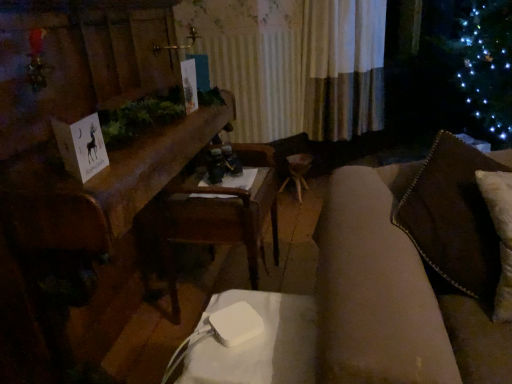
Question: Is white plastic table at lower center completely or partially inside wooden table at center?

Choices:
 (A) no
 (B) yes

Answer: (A)

Question: Can you confirm if wooden table at center is thinner than white plastic table at lower center?

Choices:
 (A) no
 (B) yes

Answer: (A)

Question: Is wooden table at center taller than white plastic table at lower center?

Choices:
 (A) no
 (B) yes

Answer: (B)

Question: Can you confirm if wooden table at center is bigger than white plastic table at lower center?

Choices:
 (A) no
 (B) yes

Answer: (B)

Question: Is wooden table at center positioned with its back to white plastic table at lower center?

Choices:
 (A) no
 (B) yes

Answer: (A)

Question: From the image's perspective, relative to white plastic table at lower center, is wooden armchair at center above or below?

Choices:
 (A) below
 (B) above

Answer: (B)

Question: Is wooden armchair at center taller or shorter than white plastic table at lower center?

Choices:
 (A) short
 (B) tall

Answer: (B)

Question: Based on their positions, is wooden armchair at center located to the left or right of white plastic table at lower center?

Choices:
 (A) left
 (B) right

Answer: (A)

Question: Does point (144, 251) appear closer or farther from the camera than point (248, 362)?

Choices:
 (A) closer
 (B) farther

Answer: (B)

Question: Which is correct: wooden table at center is inside wooden armchair at center, or outside of it?

Choices:
 (A) inside
 (B) outside

Answer: (B)

Question: Considering their positions, is wooden table at center located in front of or behind wooden armchair at center?

Choices:
 (A) behind
 (B) front

Answer: (B)

Question: From a real-world perspective, is wooden table at center above or below wooden armchair at center?

Choices:
 (A) above
 (B) below

Answer: (A)

Question: Based on their positions, is wooden table at center located to the left or right of wooden armchair at center?

Choices:
 (A) left
 (B) right

Answer: (A)

Question: In the image, is wooden table at center positioned in front of or behind white paper card at left?

Choices:
 (A) behind
 (B) front

Answer: (B)

Question: Is wooden table at center bigger or smaller than white paper card at left?

Choices:
 (A) small
 (B) big

Answer: (B)